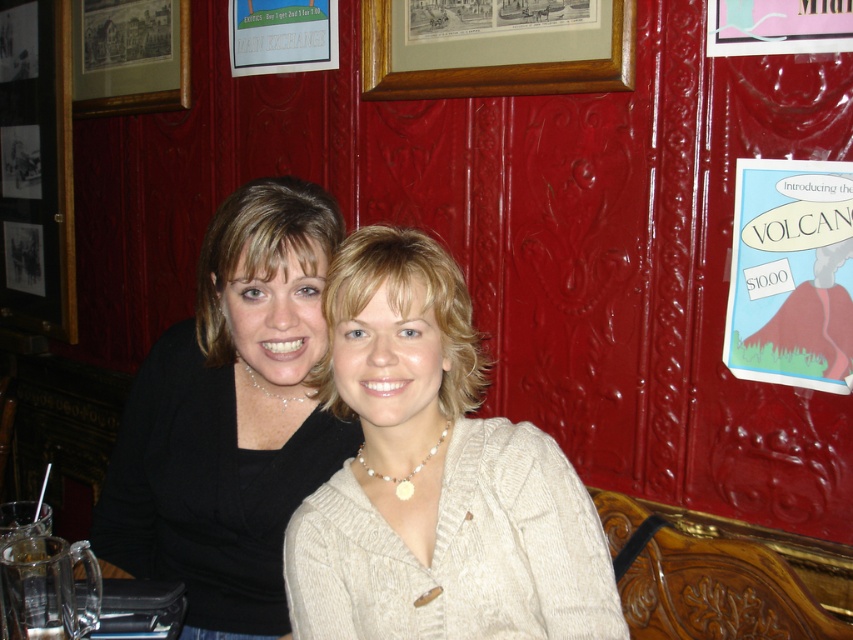
Can you confirm if matte white sweater at center is positioned below matte black sweater at center?

Correct, matte white sweater at center is located below matte black sweater at center.

The height and width of the screenshot is (640, 853). I want to click on matte white sweater at center, so click(x=434, y=476).

Identify the location of matte white sweater at center. (434, 476).

Where is `matte white sweater at center`? This screenshot has height=640, width=853. matte white sweater at center is located at coordinates (434, 476).

Which is behind, point (601, 602) or point (184, 51)?

The point (184, 51) is behind.

Who is higher up, matte white sweater at center or wooden framed print at upper left?

wooden framed print at upper left is above.

Is point (395, 451) more distant than point (151, 4)?

No, it is not.

Where is `matte white sweater at center`? The image size is (853, 640). matte white sweater at center is located at coordinates (434, 476).

In the scene shown: Does matte black sweater at center appear on the left side of wooden framed print at upper left?

Incorrect, matte black sweater at center is not on the left side of wooden framed print at upper left.

Is point (299, 241) positioned before point (99, 8)?

That is True.

Identify the location of matte black sweater at center. The width and height of the screenshot is (853, 640). (230, 417).